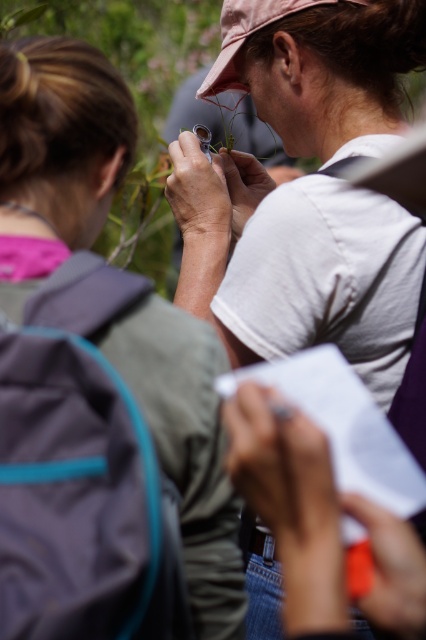
You are a researcher in the field and need to locate your white matte shirt at center. According to the coordinates provided, where exactly should you look?

The white matte shirt at center is located at point (307, 189).

You are a photographer trying to capture the scene where the person in the white matte shirt at center and the pink fabric baseball cap at upper center are positioned. Based on their spatial relationship, which object is located to the left of the other?

The pink fabric baseball cap at upper center is to the left of the white matte shirt at center.